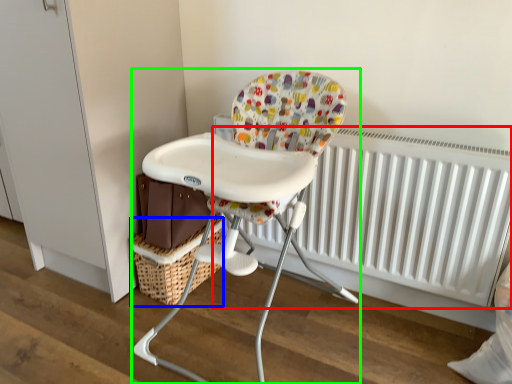
Question: Considering the real-world distances, which object is farthest from radiator (highlighted by a red box)? basket (highlighted by a blue box) or chair (highlighted by a green box)?

Choices:
 (A) basket
 (B) chair

Answer: (A)